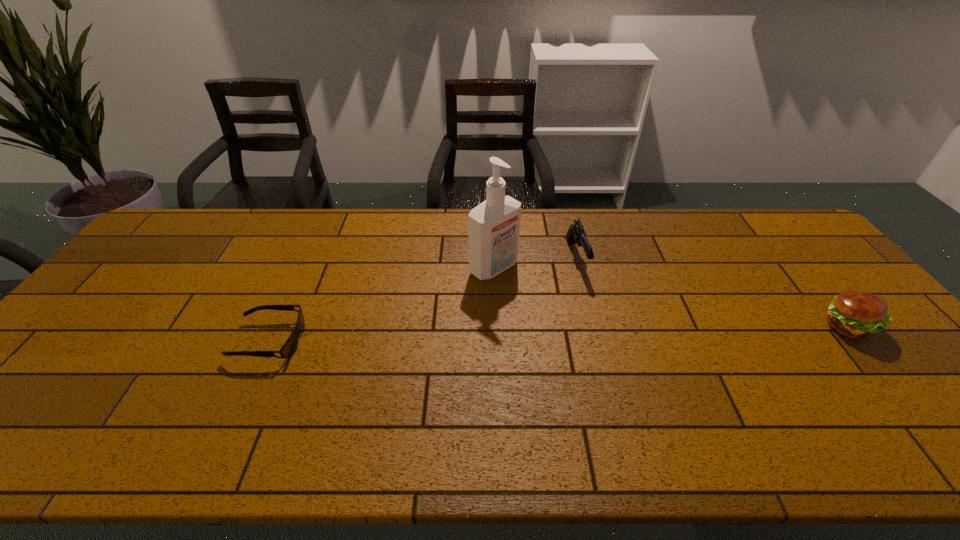
You are a GUI agent. You are given a task and a screenshot of the screen. Output one action in this format:
    pyautogui.click(x=<x>, y=<y>)
    Task: Click on the free spot on the desktop that is between the sunglasses and the rightmost object and is positioned on the front label of the cleansing agent
    This screenshot has height=540, width=960.
    Given the screenshot: What is the action you would take?
    pyautogui.click(x=582, y=333)

Where is `vacant space on the desktop that is between the shortest object and the hamburger and is positioned at the end of the barrel of the second object from right to left`? vacant space on the desktop that is between the shortest object and the hamburger and is positioned at the end of the barrel of the second object from right to left is located at coordinates [605, 332].

Where is `vacant spot on the desktop that is between the sunglasses and the rightmost object and is positioned on the face of the farthest object`? This screenshot has height=540, width=960. vacant spot on the desktop that is between the sunglasses and the rightmost object and is positioned on the face of the farthest object is located at coordinates (521, 334).